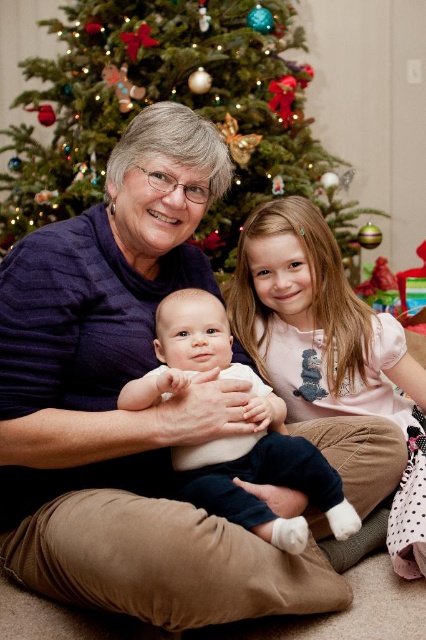
Where is the green textured christmas tree at upper center located in the image?

The green textured christmas tree at upper center is located at point (175, 100) in the image.

Please describe the location of the pink satin dress at center in the scene.

The pink satin dress at center is located at point 0.544 on the x axis and 0.772 on the y axis.

You are a photographer trying to capture a photo of the green textured christmas tree at upper center and the white soft fabric baby at center. Since you want the baby to be the main focus, which object should you position closer to the camera?

To make the white soft fabric baby at center the main focus, position it closer to the camera since it is shorter than the green textured christmas tree at upper center.